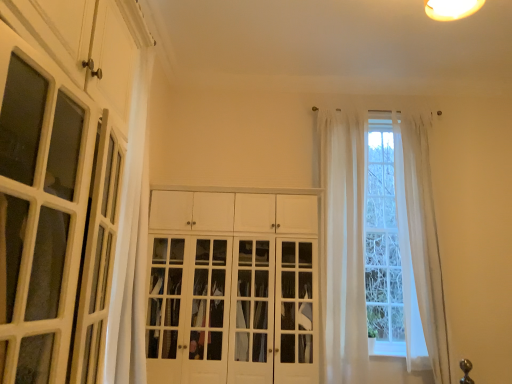
The image size is (512, 384). In order to click on white glossy cabinet doors at center in this screenshot , I will do click(233, 310).

This screenshot has width=512, height=384. Describe the element at coordinates (87, 44) in the screenshot. I see `white glossy cabinet at left` at that location.

What do you see at coordinates (421, 236) in the screenshot? The width and height of the screenshot is (512, 384). I see `white sheer curtain at right, the second curtain in the left-to-right sequence` at bounding box center [421, 236].

Locate an element on the screen. The height and width of the screenshot is (384, 512). white sheer curtain at right, the second curtain in the left-to-right sequence is located at coordinates (421, 236).

This screenshot has height=384, width=512. What are the coordinates of `white glossy cabinet doors at center` in the screenshot? It's located at (233, 310).

Is white glossy cabinet at left oriented towards white glossy cabinet doors at center?

No, white glossy cabinet at left does not turn towards white glossy cabinet doors at center.

From the image's perspective, is white glossy cabinet at left under white glossy cabinet doors at center?

No.

Considering the positions of objects white glossy cabinet at left and white glossy cabinet doors at center in the image provided, who is more to the right, white glossy cabinet at left or white glossy cabinet doors at center?

white glossy cabinet doors at center.

From a real-world perspective, who is located lower, white glossy cabinet at left or white sheer curtain at right, which appears as the 1th curtain when viewed from the right?

From a 3D spatial view, white sheer curtain at right, which appears as the 1th curtain when viewed from the right, is below.

Locate an element on the screen. The width and height of the screenshot is (512, 384). cabinetry that is in front of the white sheer curtain at right, which appears as the 1th curtain when viewed from the right is located at coordinates (87, 44).

Considering the sizes of objects white glossy cabinet at left and white sheer curtain at right, the second curtain in the left-to-right sequence, in the image provided, who is taller, white glossy cabinet at left or white sheer curtain at right, the second curtain in the left-to-right sequence,?

white sheer curtain at right, the second curtain in the left-to-right sequence.

Does point (18, 27) lie in front of point (403, 193)?

That is True.

Is sheer white curtain at center, arranged as the first curtain when viewed from the left, far from white glossy cabinet at left?

Yes.

Who is smaller, sheer white curtain at center, arranged as the first curtain when viewed from the left, or white glossy cabinet at left?

Smaller between the two is white glossy cabinet at left.

Can we say sheer white curtain at center, arranged as the first curtain when viewed from the left, lies outside white glossy cabinet at left?

Indeed, sheer white curtain at center, arranged as the first curtain when viewed from the left, is completely outside white glossy cabinet at left.

Is white glossy cabinet doors at center facing towards white sheer curtain at right, the second curtain in the left-to-right sequence?

No, white glossy cabinet doors at center is not facing towards white sheer curtain at right, the second curtain in the left-to-right sequence.

Is white glossy cabinet doors at center completely or partially outside of white sheer curtain at right, which appears as the 1th curtain when viewed from the right?

Absolutely, white glossy cabinet doors at center is external to white sheer curtain at right, which appears as the 1th curtain when viewed from the right.

Considering the points (311, 281) and (434, 337), which point is behind, point (311, 281) or point (434, 337)?

The point (434, 337) is farther.

Between white glossy cabinet doors at center and white sheer curtain at right, which appears as the 1th curtain when viewed from the right, which one appears on the left side from the viewer's perspective?

white glossy cabinet doors at center is more to the left.

Is there a large distance between sheer white curtain at center, arranged as the first curtain when viewed from the left, and white glossy cabinet doors at center?

sheer white curtain at center, arranged as the first curtain when viewed from the left, is actually quite close to white glossy cabinet doors at center.

Based on the photo, is sheer white curtain at center, which appears as the second curtain when viewed from the right, in front of white glossy cabinet doors at center?

No, sheer white curtain at center, which appears as the second curtain when viewed from the right, is further to the viewer.

Which of these two, white glossy cabinet doors at center or sheer white curtain at center, which appears as the second curtain when viewed from the right, stands taller?

sheer white curtain at center, which appears as the second curtain when viewed from the right, is taller.

Is point (199, 378) in front of point (350, 287)?

Yes, point (199, 378) is in front of point (350, 287).

Considering the sizes of objects white glossy cabinet doors at center and sheer white curtain at center, arranged as the first curtain when viewed from the left, in the image provided, who is thinner, white glossy cabinet doors at center or sheer white curtain at center, arranged as the first curtain when viewed from the left,?

sheer white curtain at center, arranged as the first curtain when viewed from the left, is thinner.

Which is correct: white glossy cabinet doors at center is inside sheer white curtain at center, arranged as the first curtain when viewed from the left, or outside of it?

white glossy cabinet doors at center is not enclosed by sheer white curtain at center, arranged as the first curtain when viewed from the left.

Considering the sizes of objects white glossy cabinet at left and sheer white curtain at center, arranged as the first curtain when viewed from the left, in the image provided, who is taller, white glossy cabinet at left or sheer white curtain at center, arranged as the first curtain when viewed from the left,?

Standing taller between the two is sheer white curtain at center, arranged as the first curtain when viewed from the left.

Is white glossy cabinet at left in front of or behind sheer white curtain at center, which appears as the second curtain when viewed from the right, in the image?

Visually, white glossy cabinet at left is located in front of sheer white curtain at center, which appears as the second curtain when viewed from the right.

From a real-world perspective, is white glossy cabinet at left positioned above or below sheer white curtain at center, arranged as the first curtain when viewed from the left?

From a real-world perspective, white glossy cabinet at left is physically above sheer white curtain at center, arranged as the first curtain when viewed from the left.

Where is `cabinetry on the left of white glossy cabinet doors at center`? The width and height of the screenshot is (512, 384). cabinetry on the left of white glossy cabinet doors at center is located at coordinates (87, 44).

The height and width of the screenshot is (384, 512). Find the location of `curtain that is the 2nd one when counting downward from the white glossy cabinet at left (from the image's perspective)`. curtain that is the 2nd one when counting downward from the white glossy cabinet at left (from the image's perspective) is located at coordinates (421, 236).

Based on their spatial positions, is white sheer curtain at right, the second curtain in the left-to-right sequence, or sheer white curtain at center, arranged as the first curtain when viewed from the left, closer to white glossy cabinet doors at center?

sheer white curtain at center, arranged as the first curtain when viewed from the left, lies closer to white glossy cabinet doors at center than the other object.

Which object lies further to the anchor point white sheer curtain at right, which appears as the 1th curtain when viewed from the right, sheer white curtain at center, which appears as the second curtain when viewed from the right, or white glossy cabinet at left?

Among the two, white glossy cabinet at left is located further to white sheer curtain at right, which appears as the 1th curtain when viewed from the right.

From the image, which object appears to be nearer to white glossy cabinet at left, sheer white curtain at center, arranged as the first curtain when viewed from the left, or white glossy cabinet doors at center?

Among the two, white glossy cabinet doors at center is located nearer to white glossy cabinet at left.

When comparing their distances from white sheer curtain at right, the second curtain in the left-to-right sequence, does white glossy cabinet doors at center or white glossy cabinet at left seem further?

Based on the image, white glossy cabinet at left appears to be further to white sheer curtain at right, the second curtain in the left-to-right sequence.

Based on their spatial positions, is white glossy cabinet doors at center or white sheer curtain at right, the second curtain in the left-to-right sequence, closer to white glossy cabinet at left?

white glossy cabinet doors at center lies closer to white glossy cabinet at left than the other object.

Based on their spatial positions, is sheer white curtain at center, which appears as the second curtain when viewed from the right, or white glossy cabinet doors at center further from white sheer curtain at right, the second curtain in the left-to-right sequence?

white glossy cabinet doors at center is further to white sheer curtain at right, the second curtain in the left-to-right sequence.

Looking at the image, which one is located closer to white glossy cabinet doors at center, white sheer curtain at right, the second curtain in the left-to-right sequence, or white glossy cabinet at left?

white sheer curtain at right, the second curtain in the left-to-right sequence, is positioned closer to the anchor white glossy cabinet doors at center.

Looking at the image, which one is located closer to white sheer curtain at right, the second curtain in the left-to-right sequence, white glossy cabinet at left or white glossy cabinet doors at center?

white glossy cabinet doors at center.

Identify the location of door between white glossy cabinet at left and white sheer curtain at right, which appears as the 1th curtain when viewed from the right. point(233,310).

At what (x,y) coordinates should I click in order to perform the action: click on curtain between white glossy cabinet doors at center and white sheer curtain at right, which appears as the 1th curtain when viewed from the right. Please return your answer as a coordinate pair (x, y). Looking at the image, I should click on (343, 248).

You are a GUI agent. You are given a task and a screenshot of the screen. Output one action in this format:
    pyautogui.click(x=<x>, y=<y>)
    Task: Click on the door between white glossy cabinet at left and sheer white curtain at center, arranged as the first curtain when viewed from the left, from front to back
    Image resolution: width=512 pixels, height=384 pixels.
    Given the screenshot: What is the action you would take?
    pyautogui.click(x=233, y=310)

Find the location of a particular element. curtain situated between white glossy cabinet at left and white sheer curtain at right, the second curtain in the left-to-right sequence, from left to right is located at coordinates (343, 248).